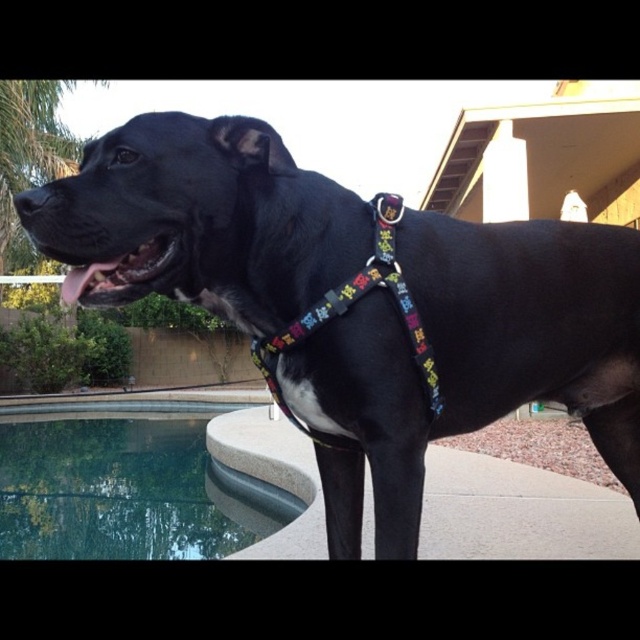
Does clear glass water at lower left have a smaller size compared to multicolored fabric harness at center?

No.

Can you confirm if clear glass water at lower left is shorter than multicolored fabric harness at center?

Incorrect, clear glass water at lower left's height does not fall short of multicolored fabric harness at center's.

The image size is (640, 640). Describe the element at coordinates (156, 480) in the screenshot. I see `clear glass water at lower left` at that location.

This screenshot has width=640, height=640. I want to click on clear glass water at lower left, so click(156, 480).

Is point (260, 124) positioned behind point (321, 429)?

No, (260, 124) is in front of (321, 429).

The image size is (640, 640). In order to click on black matte harness at center in this screenshot , I will do `click(467, 358)`.

Can you confirm if black matte harness at center is positioned below clear glass water at lower left?

Incorrect, black matte harness at center is not positioned below clear glass water at lower left.

Does black matte harness at center have a greater width compared to clear glass water at lower left?

Incorrect, black matte harness at center's width does not surpass clear glass water at lower left's.

Is point (358, 449) farther from viewer compared to point (52, 435)?

That is False.

Identify the location of black matte harness at center. Image resolution: width=640 pixels, height=640 pixels. (467, 358).